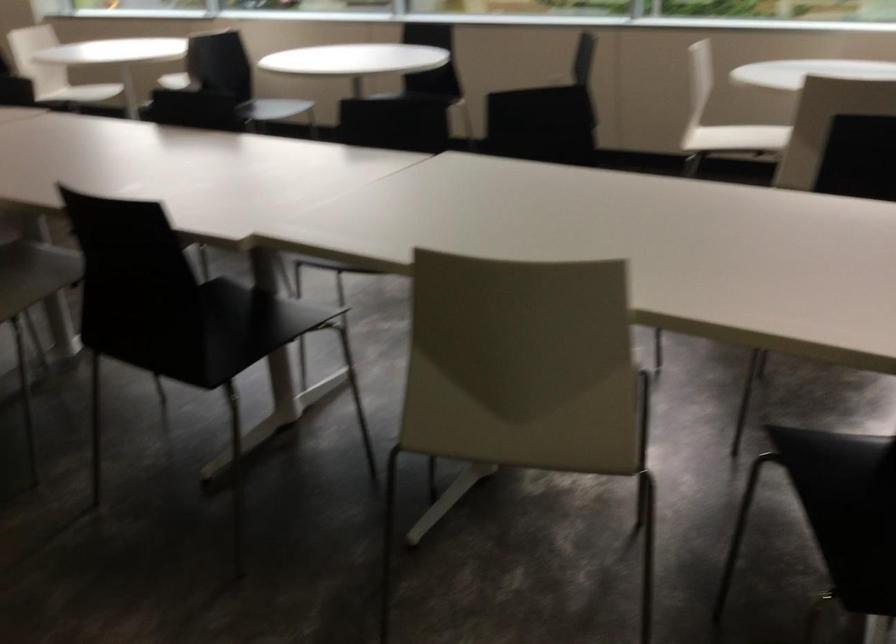
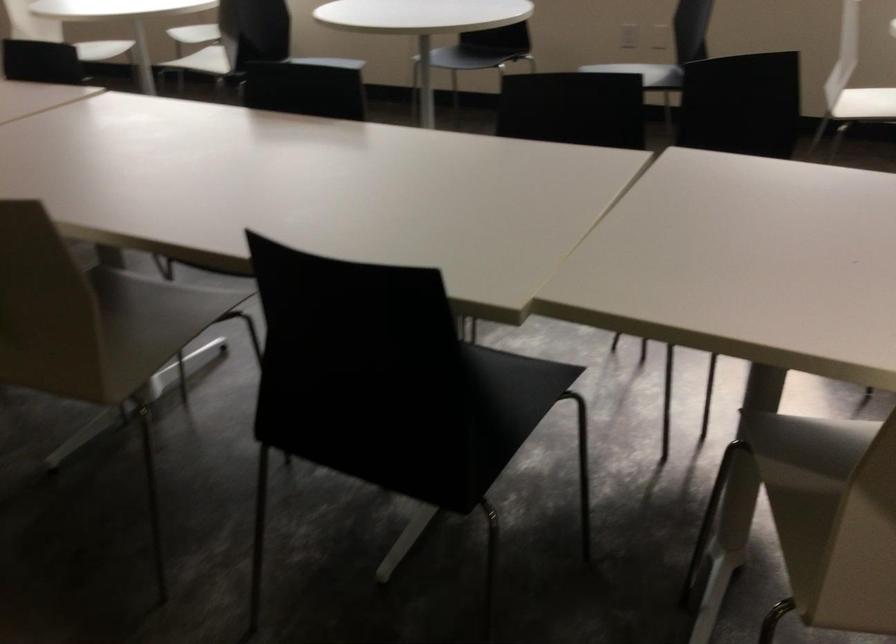
Question: How did the camera likely rotate?

Choices:
 (A) Left
 (B) Right
 (C) Up
 (D) Down

Answer: (D)